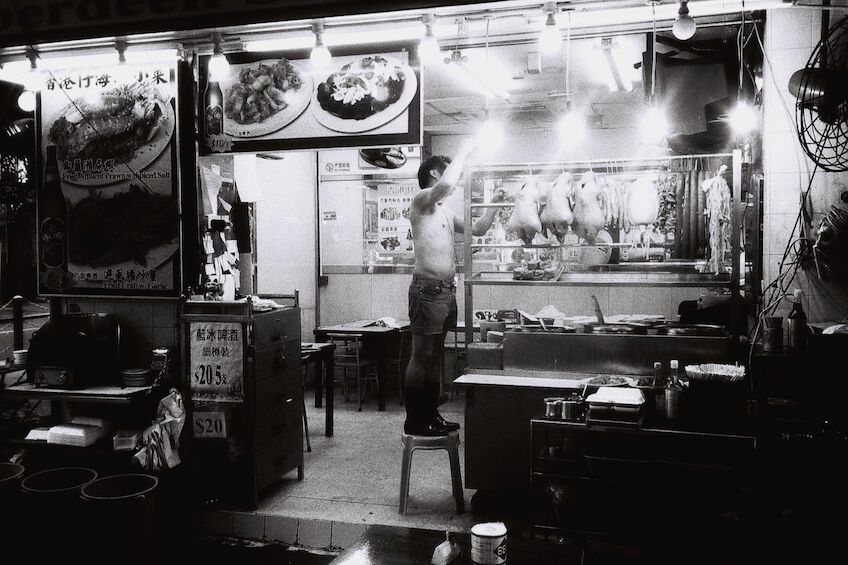
Where is `step stool`? step stool is located at coordinates (404, 463).